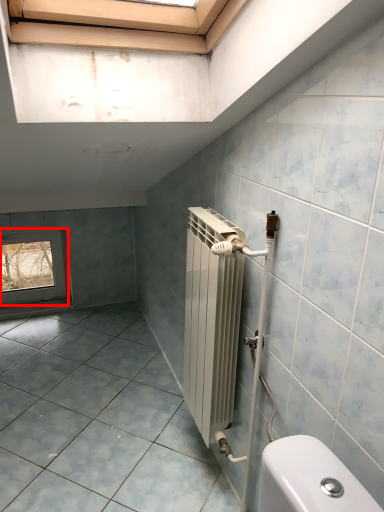
Question: In this image, where is window (annotated by the red box) located relative to ceramic tile?

Choices:
 (A) left
 (B) right

Answer: (A)